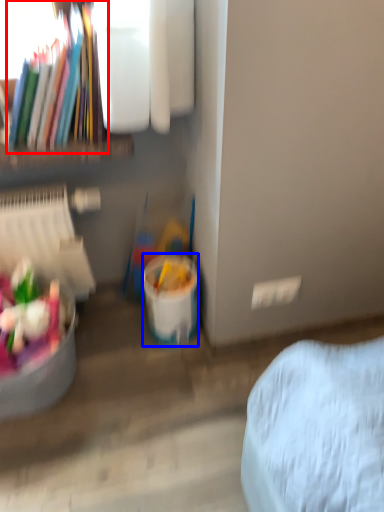
Question: Which object appears farthest to the camera in this image, book (highlighted by a red box) or bucket (highlighted by a blue box)?

Choices:
 (A) book
 (B) bucket

Answer: (B)